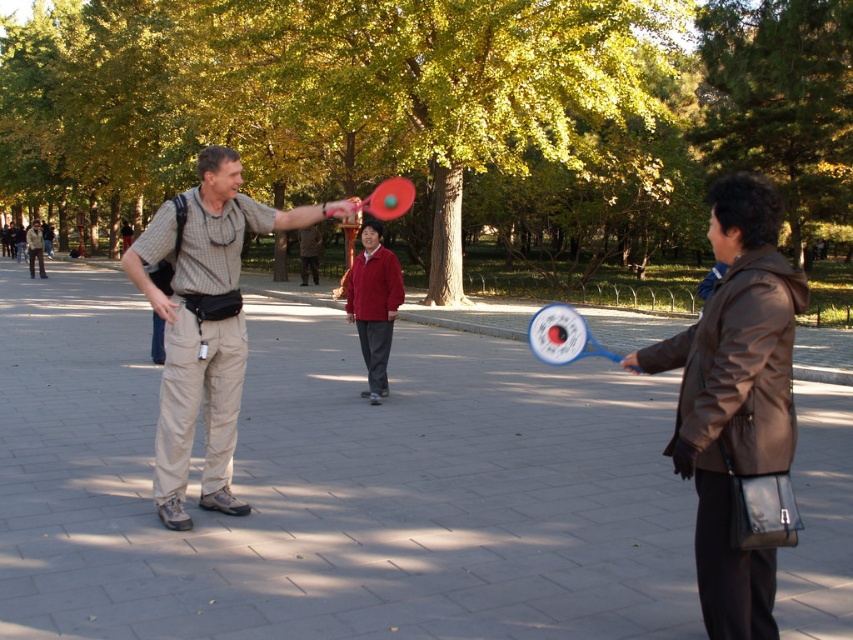
Is point (775, 432) less distant than point (222, 476)?

Yes, point (775, 432) is in front of point (222, 476).

Is point (672, 346) farther from viewer compared to point (223, 486)?

No, it is not.

Where is `brown leather jacket at right`? The image size is (853, 640). brown leather jacket at right is located at coordinates (734, 397).